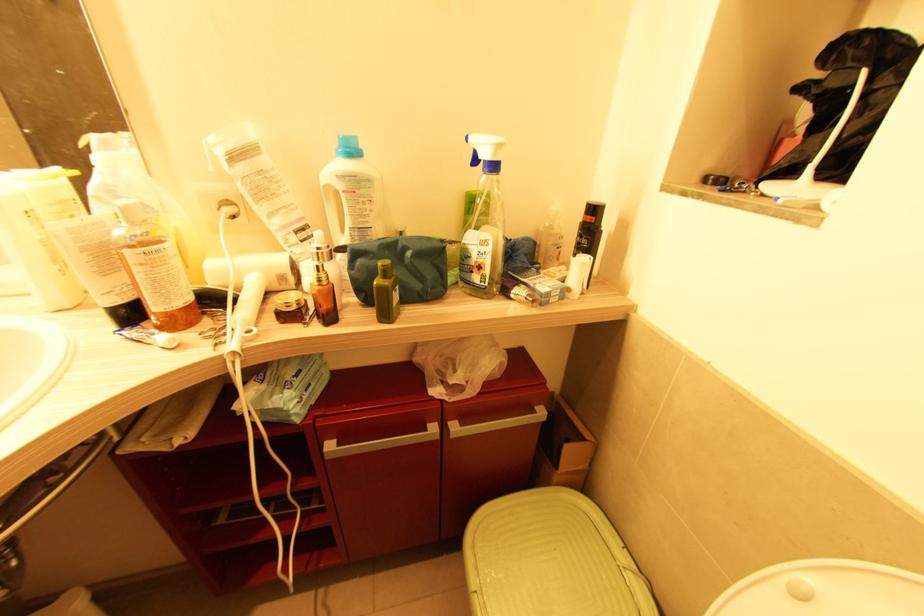
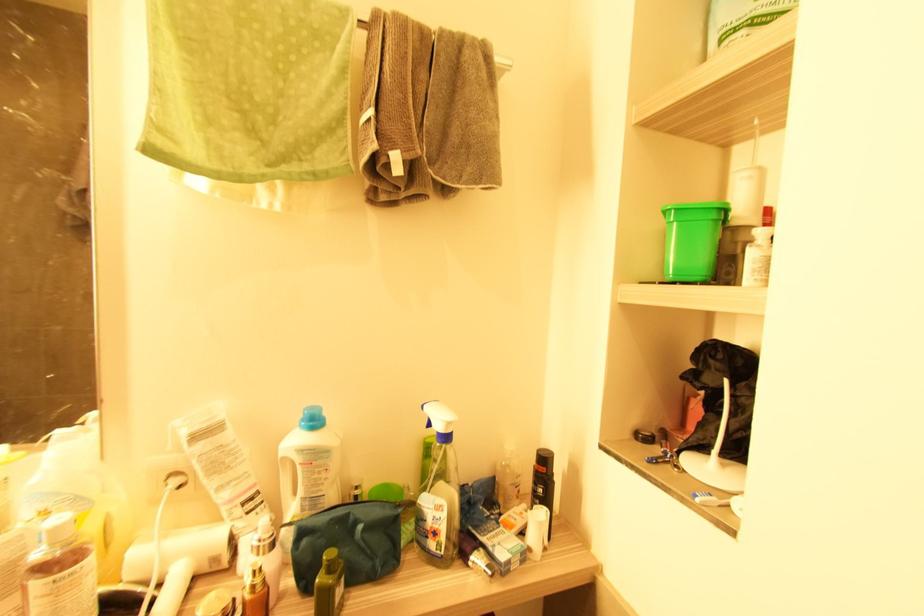
Locate, in the second image, the point that corresponds to point (386, 278) in the first image.

(331, 572)